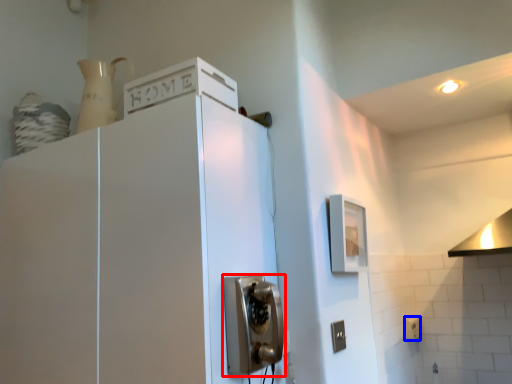
Question: Which object appears farthest to the camera in this image, door handle (highlighted by a red box) or electric outlet (highlighted by a blue box)?

Choices:
 (A) door handle
 (B) electric outlet

Answer: (B)